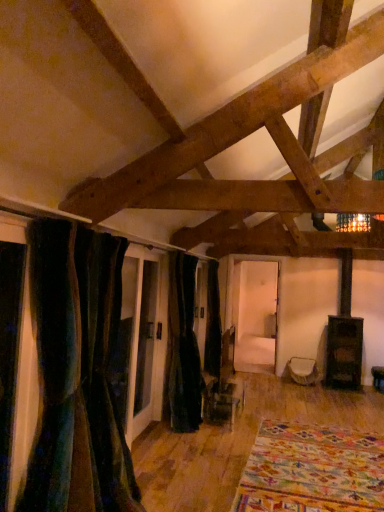
Question: Can you confirm if multicolored woven rug at lower right is smaller than white fabric ottoman at center?

Choices:
 (A) no
 (B) yes

Answer: (A)

Question: Is multicolored woven rug at lower right aimed at white fabric ottoman at center?

Choices:
 (A) yes
 (B) no

Answer: (B)

Question: Is multicolored woven rug at lower right behind white fabric ottoman at center?

Choices:
 (A) no
 (B) yes

Answer: (A)

Question: Can you confirm if multicolored woven rug at lower right is wider than white fabric ottoman at center?

Choices:
 (A) yes
 (B) no

Answer: (A)

Question: Does multicolored woven rug at lower right have a lesser height compared to white fabric ottoman at center?

Choices:
 (A) no
 (B) yes

Answer: (B)

Question: Choose the correct answer: Is velvet dark green curtain at center, the 2th curtain in the front-to-back sequence, inside white fabric ottoman at center or outside it?

Choices:
 (A) inside
 (B) outside

Answer: (B)

Question: Is velvet dark green curtain at center, the 2th curtain in the front-to-back sequence, taller or shorter than white fabric ottoman at center?

Choices:
 (A) short
 (B) tall

Answer: (B)

Question: Is velvet dark green curtain at center, the 2th curtain in the front-to-back sequence, bigger or smaller than white fabric ottoman at center?

Choices:
 (A) small
 (B) big

Answer: (B)

Question: From a real-world perspective, relative to white fabric ottoman at center, is velvet dark green curtain at center, which is counted as the first curtain, starting from the back, vertically above or below?

Choices:
 (A) above
 (B) below

Answer: (A)

Question: Considering the positions of white fabric ottoman at center and velvet dark green curtain at center, which is counted as the first curtain, starting from the back, in the image, is white fabric ottoman at center taller or shorter than velvet dark green curtain at center, which is counted as the first curtain, starting from the back,?

Choices:
 (A) short
 (B) tall

Answer: (A)

Question: Based on their sizes in the image, would you say white fabric ottoman at center is bigger or smaller than velvet dark green curtain at center, the 2th curtain in the front-to-back sequence?

Choices:
 (A) small
 (B) big

Answer: (A)

Question: From a real-world perspective, is white fabric ottoman at center physically located above or below velvet dark green curtain at center, the 2th curtain in the front-to-back sequence?

Choices:
 (A) above
 (B) below

Answer: (B)

Question: Is point click(x=311, y=367) positioned closer to the camera than point click(x=172, y=253)?

Choices:
 (A) closer
 (B) farther

Answer: (B)

Question: Does point (175, 256) appear closer or farther from the camera than point (266, 506)?

Choices:
 (A) farther
 (B) closer

Answer: (A)

Question: In the image, is velvet dark green curtain at center, the 2th curtain in the front-to-back sequence, positioned in front of or behind multicolored woven rug at lower right?

Choices:
 (A) behind
 (B) front

Answer: (A)